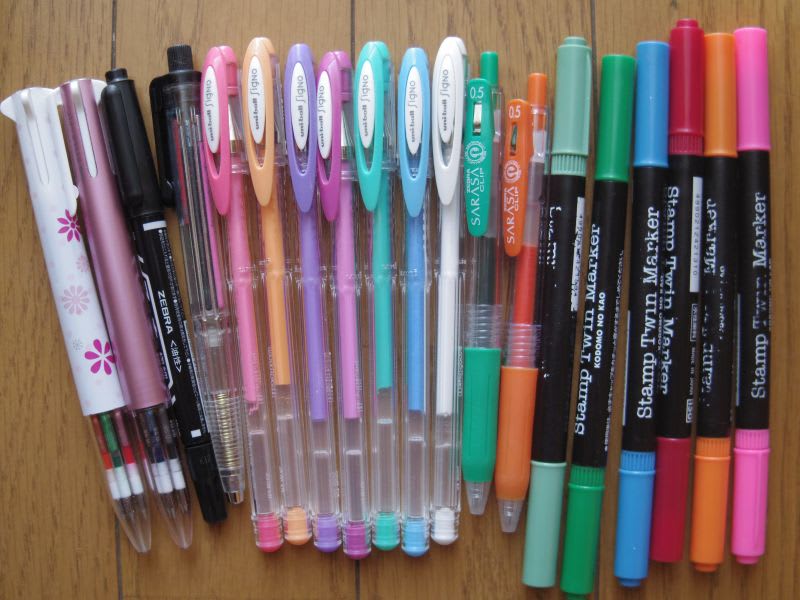
The width and height of the screenshot is (800, 600). Find the location of `wooden planks on table or floor beneath pens`. wooden planks on table or floor beneath pens is located at coordinates (56, 31), (148, 17), (392, 16), (637, 13).